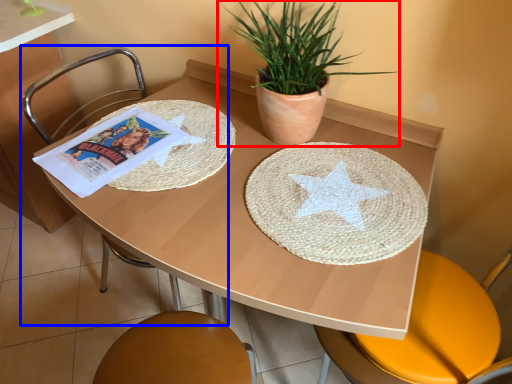
Question: Which object is closer to the camera taking this photo, houseplant (highlighted by a red box) or chair (highlighted by a blue box)?

Choices:
 (A) houseplant
 (B) chair

Answer: (A)